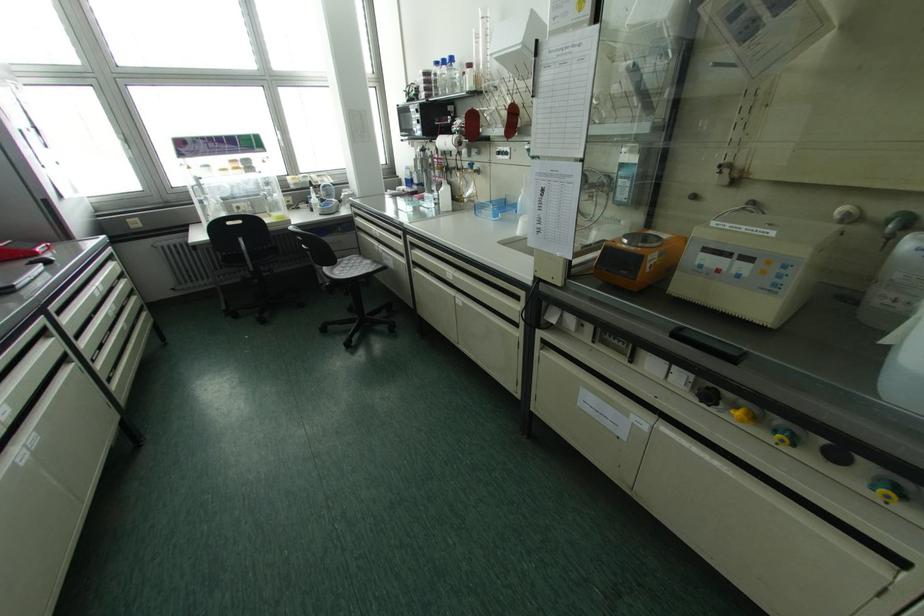
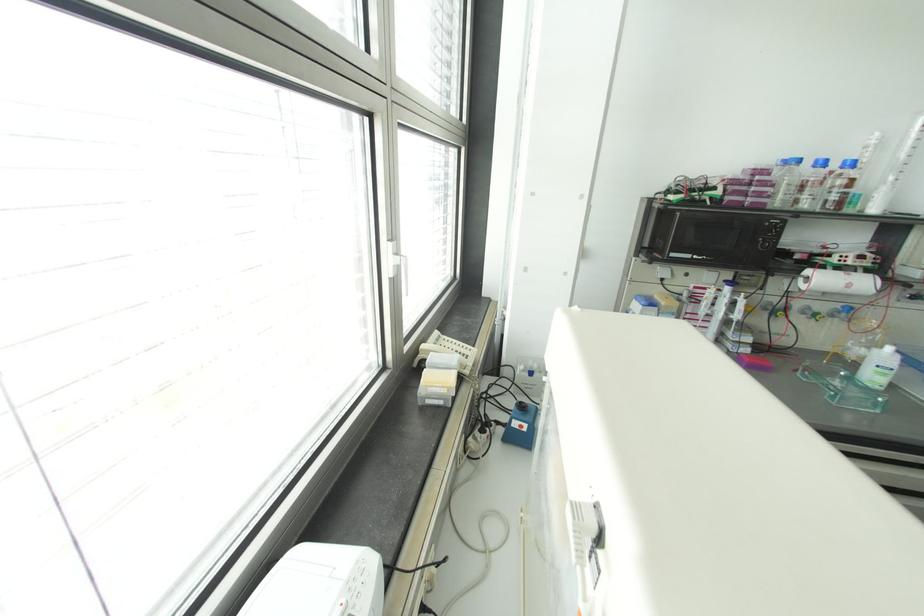
The point at (x=443, y=62) is marked in the first image. Where is the corresponding point in the second image?

(822, 163)